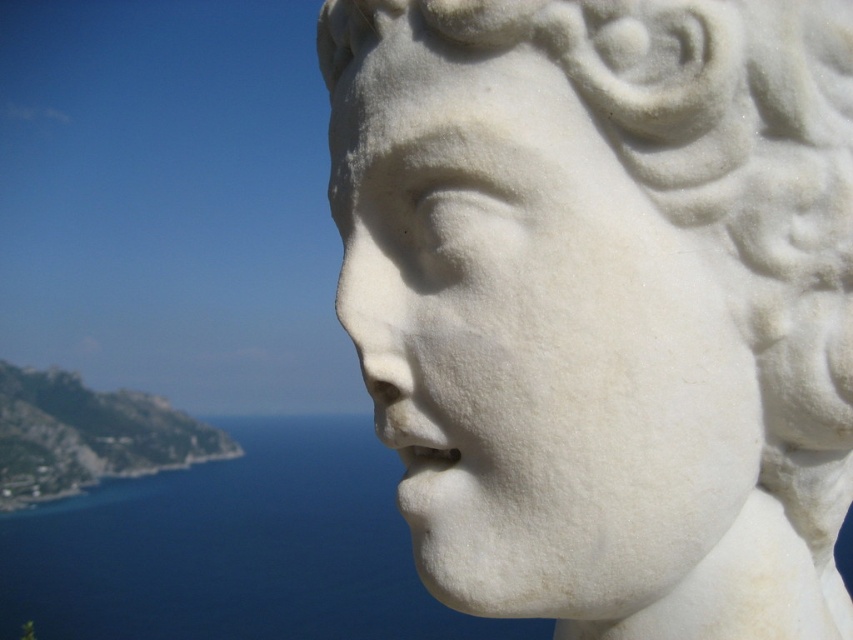
Question: Where is white marble face at center located in relation to blue water at lower left in the image?

Choices:
 (A) above
 (B) below

Answer: (A)

Question: Which object is farther from the camera taking this photo?

Choices:
 (A) blue water at lower left
 (B) white marble face at center

Answer: (A)

Question: Which of the following is the farthest from the observer?

Choices:
 (A) blue water at lower left
 (B) white marble face at center

Answer: (A)

Question: Among these objects, which one is nearest to the camera?

Choices:
 (A) blue water at lower left
 (B) white marble face at center

Answer: (B)

Question: Observing the image, what is the correct spatial positioning of white marble face at center in reference to blue water at lower left?

Choices:
 (A) below
 (B) above

Answer: (B)

Question: Does white marble face at center have a lesser width compared to blue water at lower left?

Choices:
 (A) yes
 (B) no

Answer: (A)